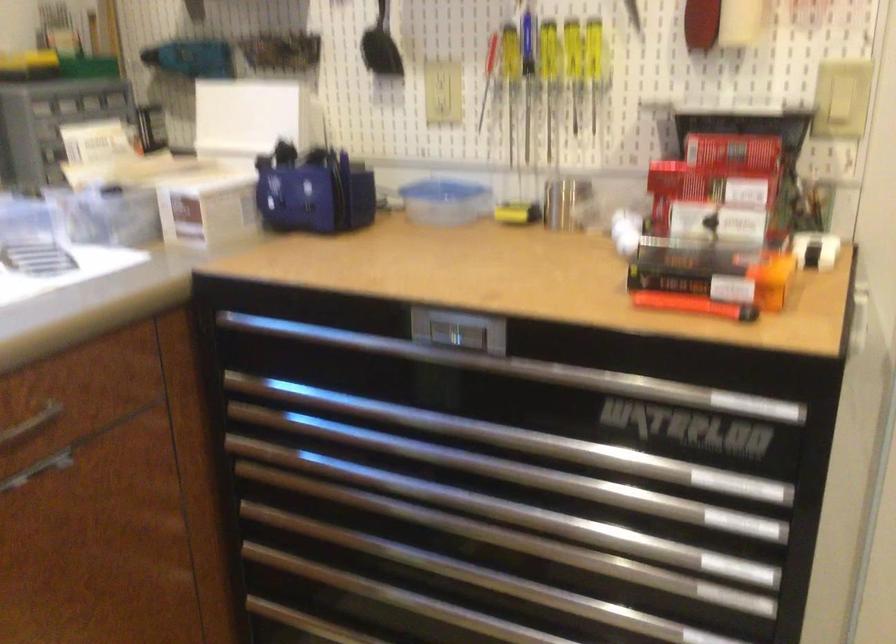
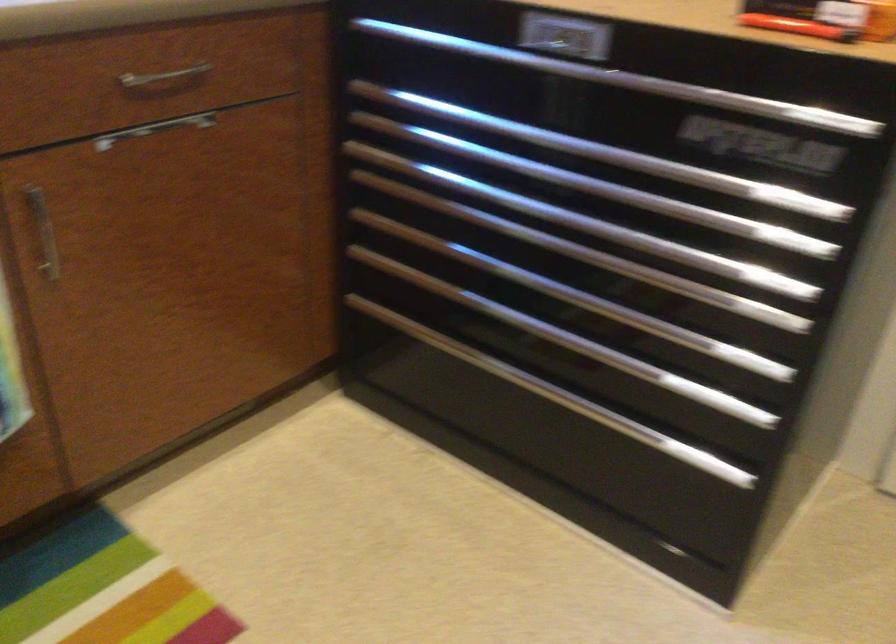
Question: I am providing you with two images of the same scene from different viewpoints. Which of the following objects are not visible in image2?

Choices:
 (A) silver cabinet pull
 (B) silver tool chest handle
 (C) orange utility knife
 (D) none of these

Answer: (D)